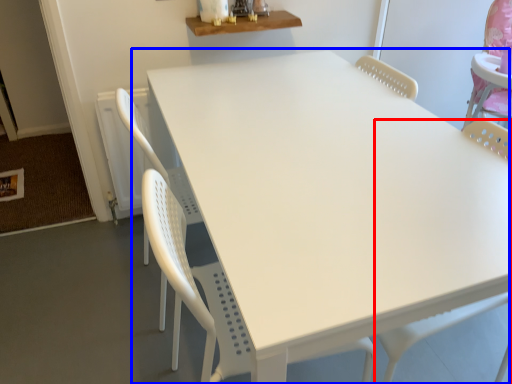
Question: Which of the following is the farthest to the observer, swivel chair (highlighted by a red box) or table (highlighted by a blue box)?

Choices:
 (A) swivel chair
 (B) table

Answer: (B)